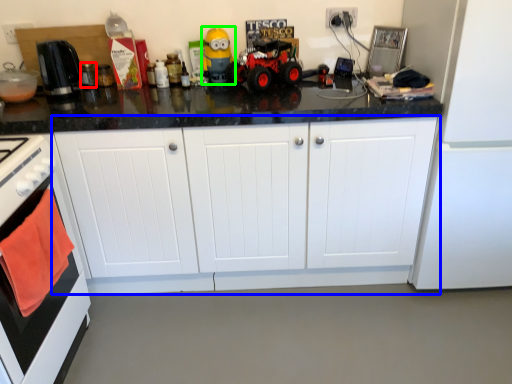
Question: Which is farther away from appliance (highlighted by a red box)? cabinetry (highlighted by a blue box) or toy (highlighted by a green box)?

Choices:
 (A) cabinetry
 (B) toy

Answer: (A)